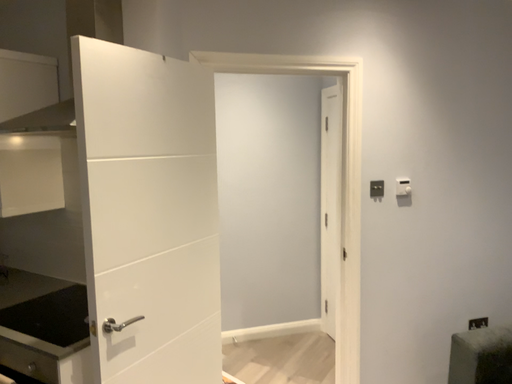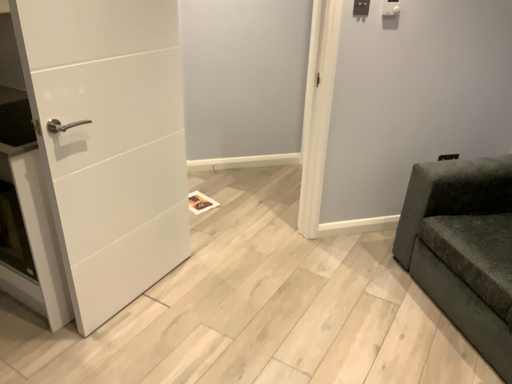
Question: How did the camera likely rotate when shooting the video?

Choices:
 (A) rotated downward
 (B) rotated upward

Answer: (A)